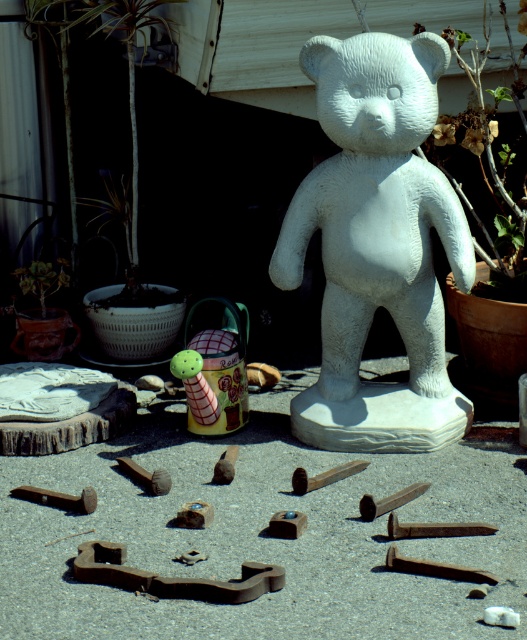
Question: Observing the image, what is the correct spatial positioning of white stone bear at center in reference to green rubber toy at center?

Choices:
 (A) right
 (B) left

Answer: (A)

Question: From the image, what is the correct spatial relationship of white stone bear at center in relation to green rubber toy at center?

Choices:
 (A) left
 (B) right

Answer: (B)

Question: Is white stone bear at center smaller than green rubber toy at center?

Choices:
 (A) no
 (B) yes

Answer: (A)

Question: Among these objects, which one is nearest to the camera?

Choices:
 (A) white stone bear at center
 (B) green rubber toy at center

Answer: (A)

Question: Which of the following is the closest to the observer?

Choices:
 (A) green rubber toy at center
 (B) white stone bear at center

Answer: (B)

Question: Which of the following is the closest to the observer?

Choices:
 (A) white stone bear at center
 (B) green rubber toy at center

Answer: (A)